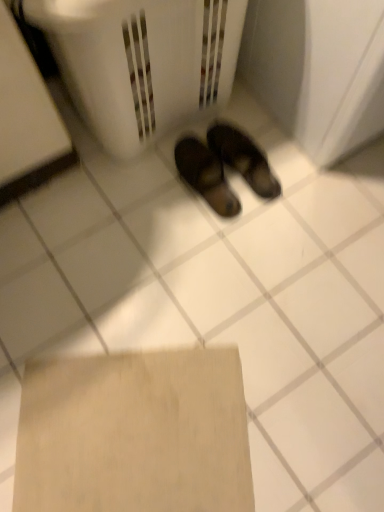
Question: From their relative heights in the image, would you say brown leather sandals at center is taller or shorter than white plastic laundry basket at center?

Choices:
 (A) short
 (B) tall

Answer: (A)

Question: Based on their sizes in the image, would you say brown leather sandals at center is bigger or smaller than white plastic laundry basket at center?

Choices:
 (A) small
 (B) big

Answer: (A)

Question: Estimate the real-world distances between objects in this image. Which object is closer to the white plastic laundry basket at center?

Choices:
 (A) beige cardboard at lower center
 (B) brown leather sandals at center

Answer: (B)

Question: Which of these objects is positioned closest to the brown leather sandals at center?

Choices:
 (A) beige cardboard at lower center
 (B) white plastic laundry basket at center

Answer: (B)